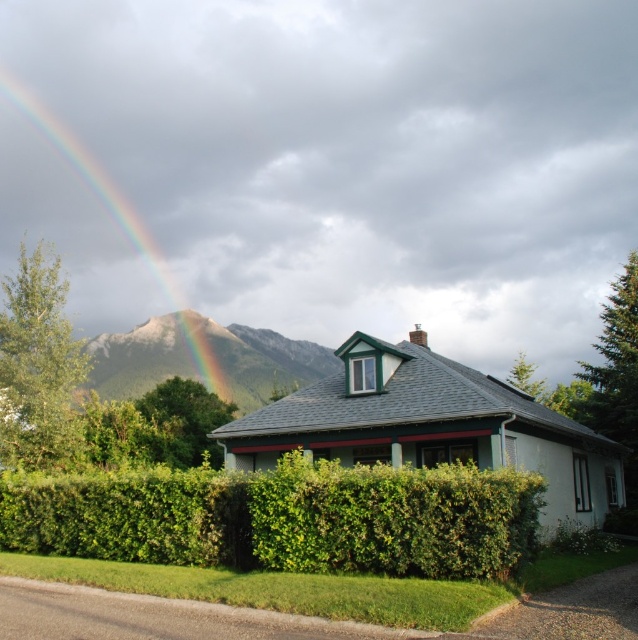
From the picture: Which is above, green leafy hedge at center or rugged granite mountain at upper left?

Positioned higher is rugged granite mountain at upper left.

Consider the image. Can you confirm if green leafy hedge at center is thinner than rugged granite mountain at upper left?

Correct, green leafy hedge at center's width is less than rugged granite mountain at upper left's.

Which is behind, point (380, 540) or point (281, 376)?

The point (281, 376) is more distant.

I want to click on green leafy hedge at center, so click(x=285, y=518).

Who is more distant from viewer, (218, 333) or (0, 80)?

Point (0, 80)

Identify the location of rugged granite mountain at upper left. Image resolution: width=638 pixels, height=640 pixels. (204, 358).

Who is more distant from viewer, (107,340) or (75,156)?

The point (75,156) is more distant.

Where is `rugged granite mountain at upper left`? Image resolution: width=638 pixels, height=640 pixels. rugged granite mountain at upper left is located at coordinates click(x=204, y=358).

Is green leafy hedge at center smaller than rainbow at upper left?

Correct, green leafy hedge at center occupies less space than rainbow at upper left.

What do you see at coordinates (285, 518) in the screenshot? This screenshot has width=638, height=640. I see `green leafy hedge at center` at bounding box center [285, 518].

Which is behind, point (445, 547) or point (98, 182)?

Positioned behind is point (98, 182).

The width and height of the screenshot is (638, 640). Find the location of `green leafy hedge at center`. green leafy hedge at center is located at coordinates (285, 518).